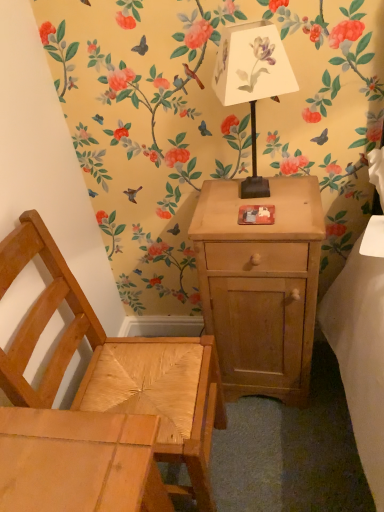
The image size is (384, 512). Identify the location of free space above white paper lampshade at upper center (from a real-world perspective). (244, 24).